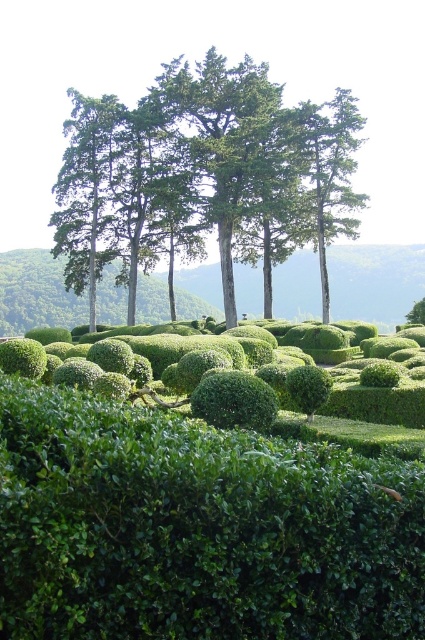
Looking at this image, who is more forward, [175,108] or [316,184]?

Positioned in front is point [175,108].

The height and width of the screenshot is (640, 425). I want to click on green leafy trees at upper center, so click(x=232, y=170).